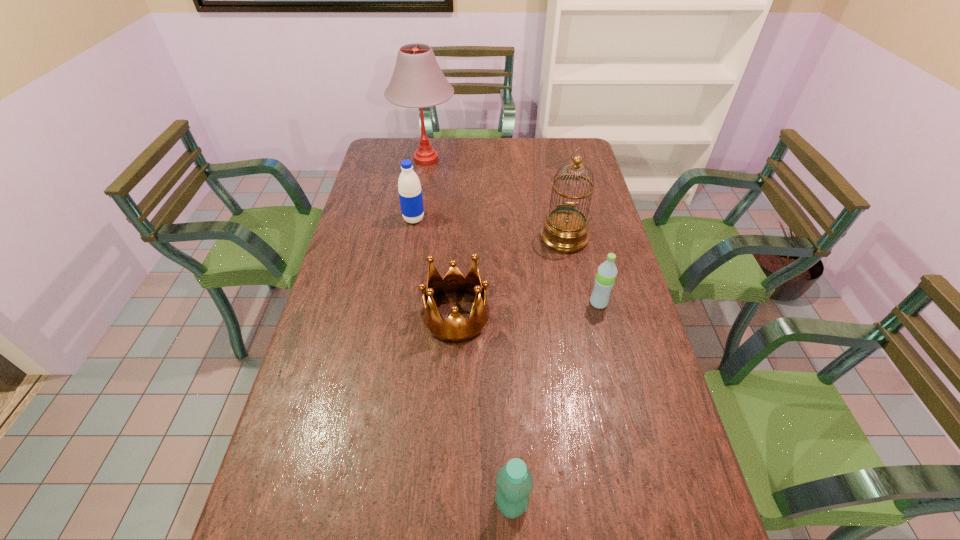
The height and width of the screenshot is (540, 960). I want to click on vacant space located with an open door on the birdcage, so click(x=577, y=301).

Identify the location of free region located on the back of the leftmost water bottle. click(421, 171).

Identify the location of free location located on the front of the rightmost water bottle. The height and width of the screenshot is (540, 960). (622, 399).

Find the location of `blank space located 0.230m on the front of the crown`. blank space located 0.230m on the front of the crown is located at coordinates (451, 423).

Where is `object situated at the far edge`? object situated at the far edge is located at coordinates (417, 82).

Locate an element on the screen. The width and height of the screenshot is (960, 540). object that is at the left edge is located at coordinates (417, 82).

Where is `birdcage located at the right edge`? The height and width of the screenshot is (540, 960). birdcage located at the right edge is located at coordinates (565, 229).

This screenshot has width=960, height=540. I want to click on water bottle that is positioned at the right edge, so click(x=607, y=271).

Identify the location of object positioned at the far left corner. The height and width of the screenshot is (540, 960). (417, 82).

Identify the location of vacant space at the far edge of the desktop. Image resolution: width=960 pixels, height=540 pixels. (540, 158).